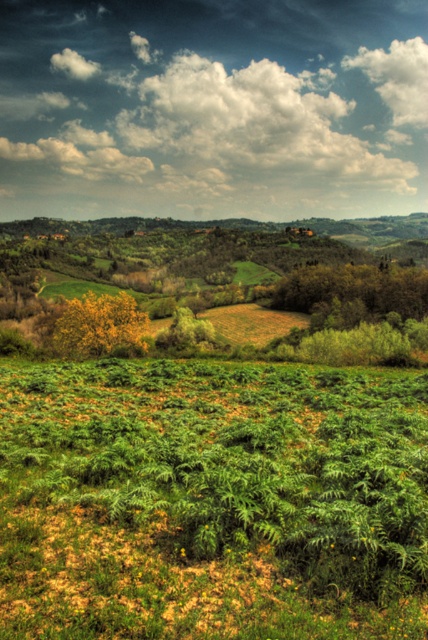
You are a weather balloon operator preparing to launch a balloon that can ascend up to 500 meters. You observe the white fluffy cloud at upper center in the sky. Can your balloon reach it?

The white fluffy cloud at upper center is 608.85 meters away from the viewer, so the balloon cannot reach it since its maximum altitude is 500 meters.

You are an airplane passenger looking out the window and see the white fluffy cloud at upper center and the white fluffy cloud at upper right. Which cloud is closer to the ground?

The white fluffy cloud at upper center is closer to the ground because it is located below the white fluffy cloud at upper right.